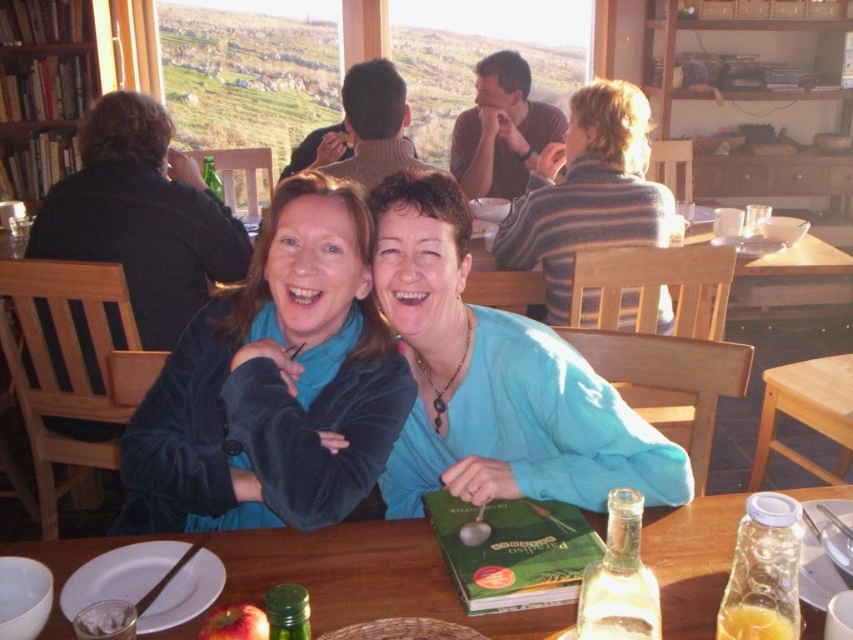
You are standing at the entrance of the cafe and want to sit at the wooden table at lower center. Which direction should you walk to reach it?

The wooden table at lower center is located at point (364, 577), so you should walk towards the lower center direction to reach it.

What object is located at the coordinate point (364, 577) in the image?

The wooden table at lower center is located at the coordinate point (364, 577).

You are a server in a cozy cafe and need to place a red smooth apple at lower left on the wooden table at lower center. Can you fit the apple on the table?

The wooden table at lower center might be wider than the red smooth apple at lower left, so there is a possibility that the apple can be placed on the table. However, the exact dimensions are uncertain, so it is advisable to check the table size before placing the apple.